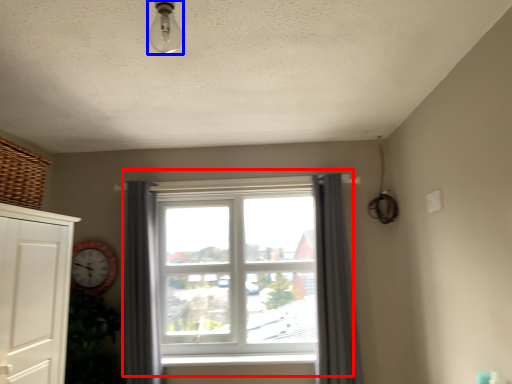
Question: Which point is further to the camera, window (highlighted by a red box) or light fixture (highlighted by a blue box)?

Choices:
 (A) window
 (B) light fixture

Answer: (A)